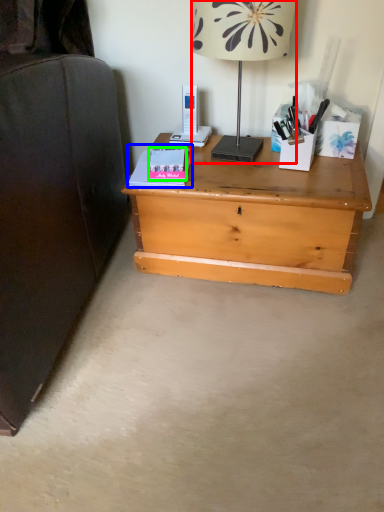
Question: Considering the real-world distances, which object is farthest from lamp (highlighted by a red box)? paperback book (highlighted by a blue box) or paperback book (highlighted by a green box)?

Choices:
 (A) paperback book
 (B) paperback book

Answer: (A)